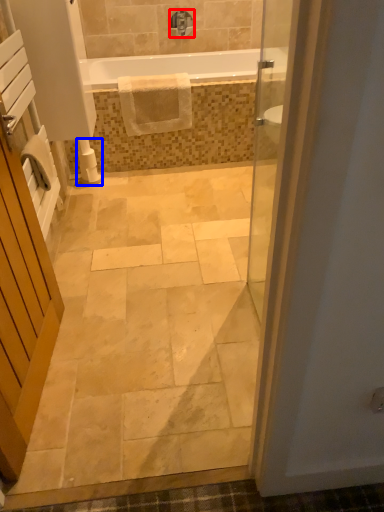
Question: Which of the following is the farthest to the observer, tap (highlighted by a red box) or toilet paper (highlighted by a blue box)?

Choices:
 (A) tap
 (B) toilet paper

Answer: (A)